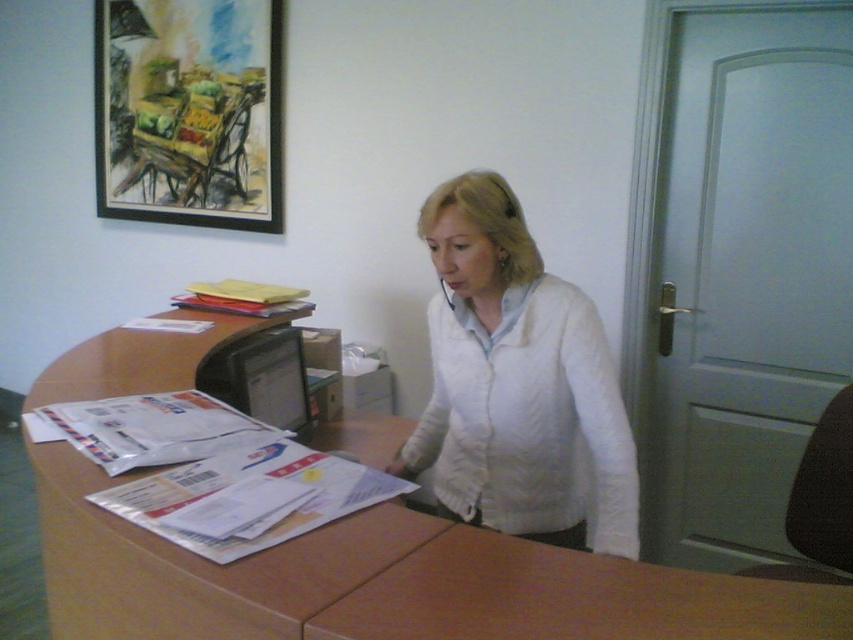
You are an office worker who needs to place a new document on the brown wooden table at center and the matte black monitor at center. According to the scene, which object should you approach first if you are standing to the left of both objects?

You should approach the matte black monitor at center first because the brown wooden table at center is to the right of the matte black monitor at center. Since you are standing to the left of both, the monitor is closer to you.

Based on the photo, in the office scene, there are two objects labeled as brown wood table at center and brown wooden table at center. According to the description, one is above the other. Which one is positioned higher?

The brown wood table at center is positioned higher as it is described to be above the brown wooden table at center.